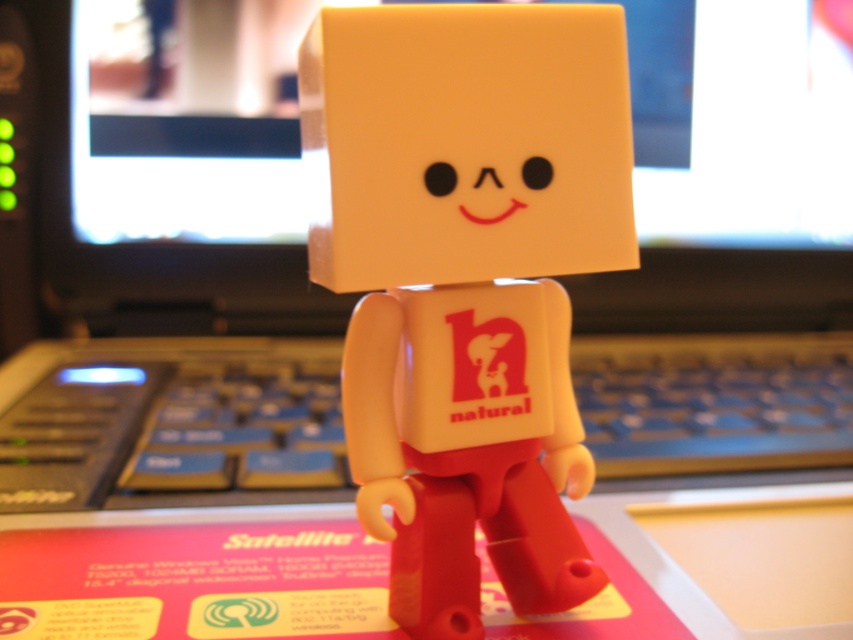
Question: Estimate the real-world distances between objects in this image. Which object is farther from the matte plastic figurine at center?

Choices:
 (A) blue plastic keyboard at center
 (B) matte black monitor at center

Answer: (B)

Question: Which of the following is the closest to the observer?

Choices:
 (A) (622, 307)
 (B) (561, 378)

Answer: (B)

Question: Which object is closer to the camera taking this photo?

Choices:
 (A) matte plastic figurine at center
 (B) blue plastic keyboard at center
 (C) matte black monitor at center

Answer: (A)

Question: Is matte plastic figurine at center above matte black monitor at center?

Choices:
 (A) yes
 (B) no

Answer: (B)

Question: Does matte plastic figurine at center appear on the left side of blue plastic keyboard at center?

Choices:
 (A) no
 (B) yes

Answer: (A)

Question: Is matte black monitor at center positioned at the back of blue plastic keyboard at center?

Choices:
 (A) yes
 (B) no

Answer: (A)